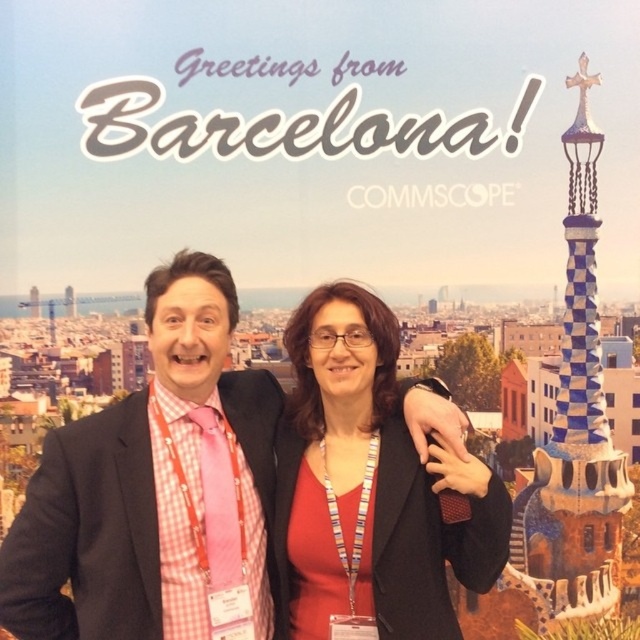
Question: Where is pink checkered shirt at center located in relation to matte black jacket at center in the image?

Choices:
 (A) left
 (B) right

Answer: (A)

Question: Which of the following is the closest to the observer?

Choices:
 (A) matte black jacket at center
 (B) pink checkered shirt at center

Answer: (B)

Question: Does pink checkered shirt at center appear over matte black jacket at center?

Choices:
 (A) no
 (B) yes

Answer: (A)

Question: Which of the following is the farthest from the observer?

Choices:
 (A) (150, 470)
 (B) (408, 486)

Answer: (B)

Question: Is pink checkered shirt at center further to camera compared to matte black jacket at center?

Choices:
 (A) no
 (B) yes

Answer: (A)

Question: Among these objects, which one is nearest to the camera?

Choices:
 (A) pink checkered shirt at center
 (B) matte black jacket at center

Answer: (A)